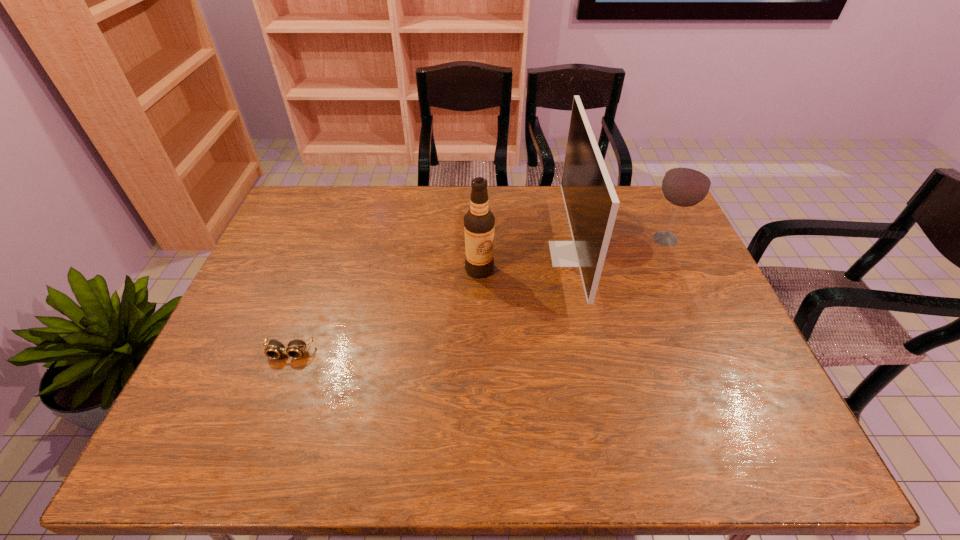
I want to click on free region located on the front-facing side of the monitor, so click(x=477, y=254).

This screenshot has width=960, height=540. I want to click on vacant space located on the label of the nearer alcohol, so click(479, 373).

I want to click on vacant space located 0.250m on the left of the farther alcohol, so click(x=567, y=239).

Locate an element on the screen. vacant region located through the lenses of the shortest object is located at coordinates (276, 386).

Find the location of `monitor at the far edge`. monitor at the far edge is located at coordinates (591, 202).

The width and height of the screenshot is (960, 540). Identify the location of alcohol located in the far edge section of the desktop. (687, 182).

The width and height of the screenshot is (960, 540). Identify the location of object located in the left edge section of the desktop. (296, 348).

Locate an element on the screen. object at the right edge is located at coordinates (687, 182).

Identify the location of object at the far right corner. This screenshot has width=960, height=540. (687, 182).

At what (x,y) coordinates should I click in order to perform the action: click on vacant space at the far edge. Please return your answer as a coordinate pair (x, y). The image size is (960, 540). Looking at the image, I should click on (560, 199).